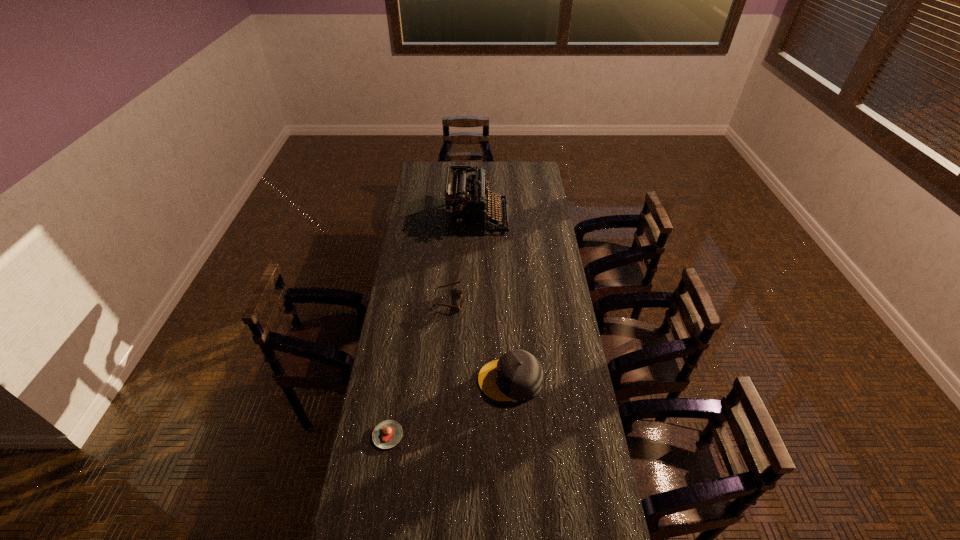
I want to click on the third closest object to the second tallest object, so click(x=465, y=206).